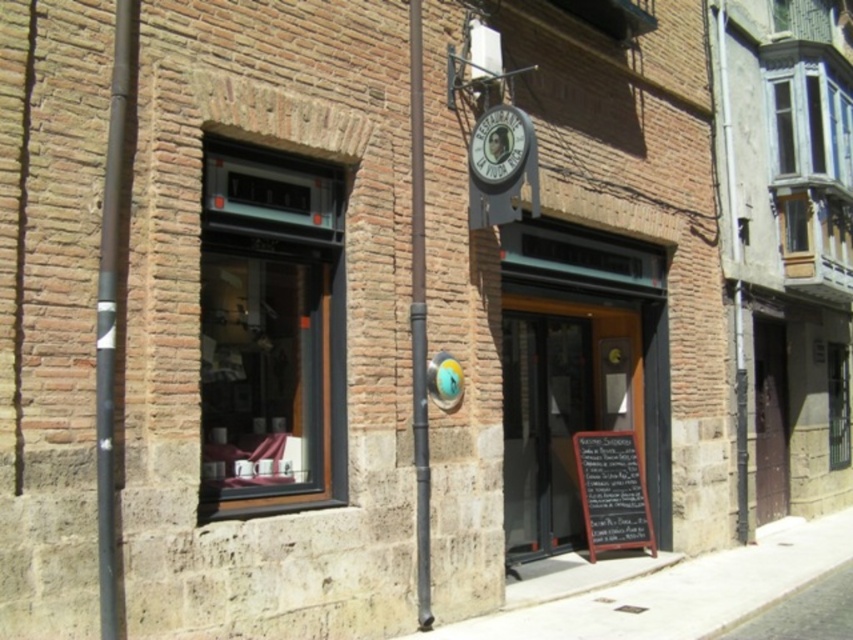
Question: Is clear glass window at center below smooth metal pole at center?

Choices:
 (A) no
 (B) yes

Answer: (B)

Question: Which of the following is the closest to the observer?

Choices:
 (A) clear glass window at center
 (B) black chalkboard at lower right
 (C) metallic signboard at upper center

Answer: (A)

Question: Observing the image, what is the correct spatial positioning of clear glass window at center in reference to black matte pole at left?

Choices:
 (A) right
 (B) left

Answer: (A)

Question: Estimate the real-world distances between objects in this image. Which object is farther from the clear glass window at right?

Choices:
 (A) clear glass window at center
 (B) black chalkboard at lower right
 (C) smooth metal pole at center
 (D) white concrete pavement at lower right

Answer: (A)

Question: Which object is the closest to the black chalkboard at lower right?

Choices:
 (A) blue painted wood window at upper right
 (B) wooden door at center
 (C) black matte pole at left
 (D) smooth metal pole at center

Answer: (B)

Question: Observing the image, what is the correct spatial positioning of clear glass window at center in reference to wooden door at center?

Choices:
 (A) below
 (B) above

Answer: (B)